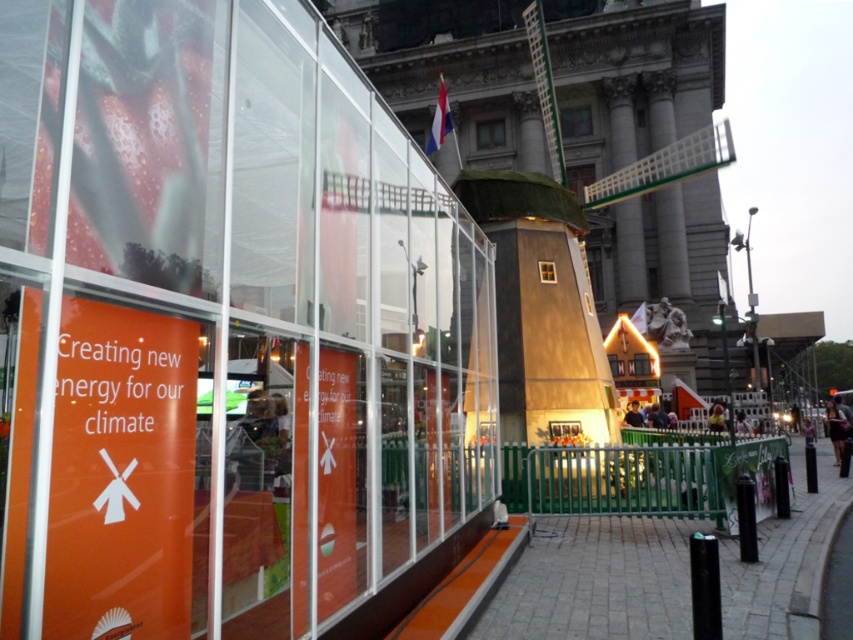
You are a city planner assessing the space between the paved stone pavement at center and the wooden windmill at center. If you want to install a new bench that is 2 meters wide, will there be enough space between them?

The paved stone pavement at center is wider than the wooden windmill at center. However, the description only provides relative width comparison between the two objects and does not specify their exact distance apart. Therefore, it is unclear if there is sufficient space to install a 2 meter wide bench between them.

Based on the photo, you are a tour guide explaining the new energy initiatives to visitors. You point to the orange matte sign at lower left and the wooden windmill at center. Which one is located to the left of the other?

The orange matte sign at lower left is positioned on the left side of wooden windmill at center.

You are standing at the point indicated by the coordinates point (120, 476) in the image. What object are you directly facing? Please answer with the object label from the Objects list.

The point (120, 476) indicates orange matte sign at lower left, so you are directly facing the orange matte sign at lower left.